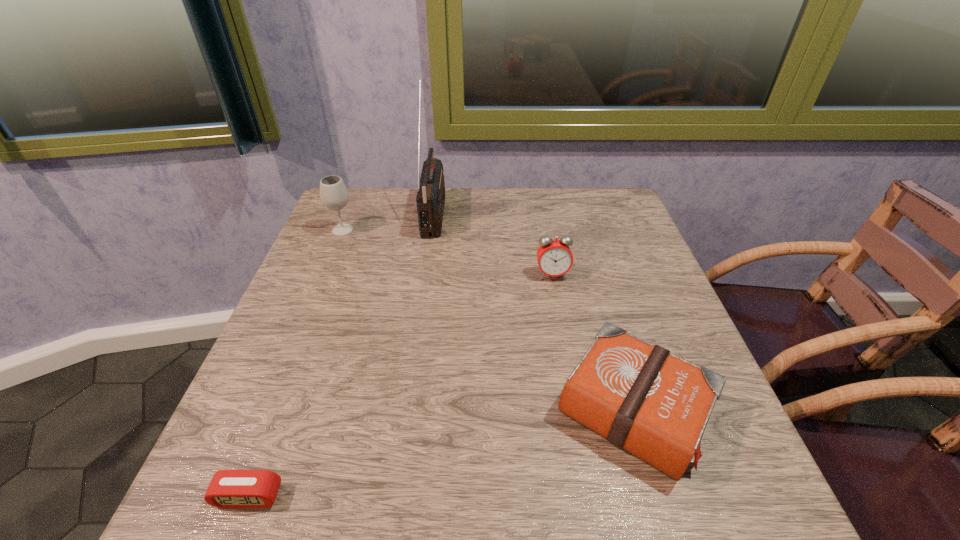
You are a GUI agent. You are given a task and a screenshot of the screen. Output one action in this format:
    pyautogui.click(x=<x>, y=<y>)
    Task: Click on the third object from left to right
    The image size is (960, 540).
    Given the screenshot: What is the action you would take?
    pyautogui.click(x=430, y=199)

Identify the location of the tallest object. The height and width of the screenshot is (540, 960). (430, 199).

Find the location of a particular element. The image size is (960, 540). wineglass is located at coordinates (334, 195).

Where is `the third shortest object`? The height and width of the screenshot is (540, 960). the third shortest object is located at coordinates (554, 256).

Find the location of a particular element. This screenshot has height=540, width=960. the third nearest object is located at coordinates (554, 256).

Image resolution: width=960 pixels, height=540 pixels. Identify the location of Bible. (640, 397).

Image resolution: width=960 pixels, height=540 pixels. What are the coordinates of `the shortest object` in the screenshot? It's located at (228, 488).

Identify the location of the nearer alarm clock. The image size is (960, 540). (228, 488).

What are the coordinates of `vacant space situated on the front-facing side of the tallest object` in the screenshot? It's located at (520, 213).

At what (x,y) coordinates should I click in order to perform the action: click on free space located on the back of the wineglass. Please return your answer as a coordinate pair (x, y). Image resolution: width=960 pixels, height=540 pixels. Looking at the image, I should click on (353, 203).